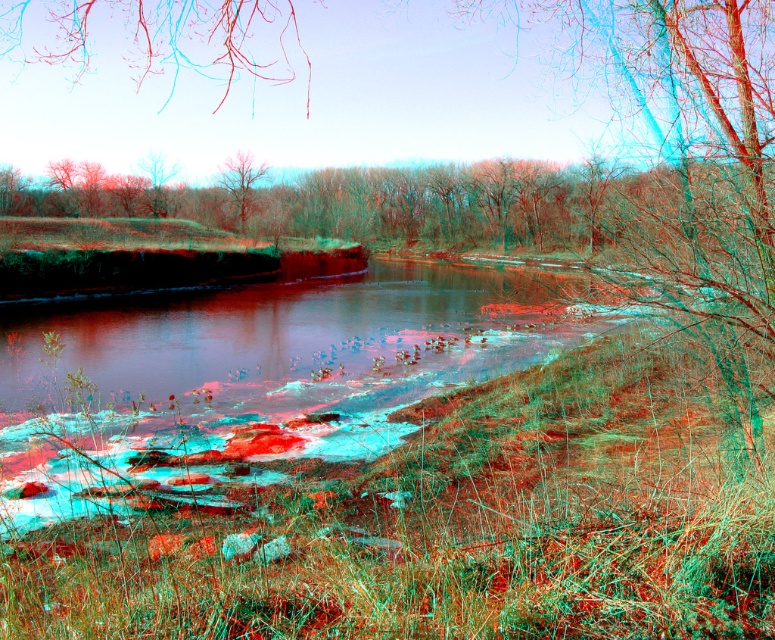
Based on the photo, you are standing in the serene natural scene and want to take a photo of both the smooth bark tree at center and the smooth bark tree at upper left. Which tree should you focus on first to ensure both are in clear view?

You should focus on the smooth bark tree at center first because it is closer to the viewer than the smooth bark tree at upper left, so adjusting focus from near to far will help both be in clear view.

You are standing in the serene natural scene depicted in the image. You notice two points marked in the scene. The first point is located at coordinates point [570,170], and the second point is at point [170,173]. Which of these two points is closer to your current position?

Point [170,173] is closer to your current position because it is less further to the camera than point [570,170].

Please provide the 2D coordinates of the green matte tree at center in the scene described.

The green matte tree at center is located at the 2D coordinates of point (491, 204).